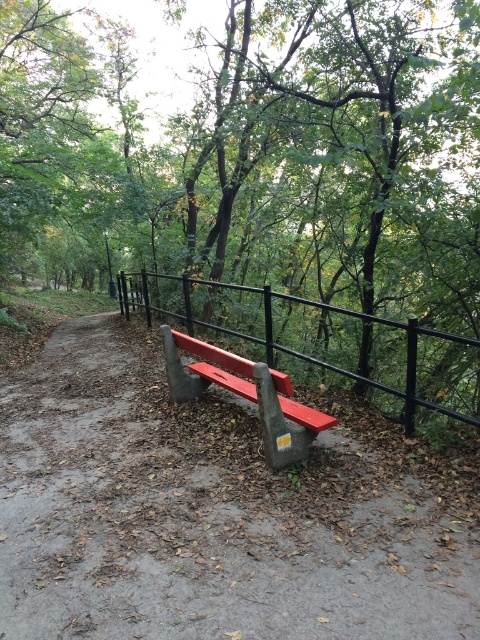
You are planning to take a photo of the smooth metal bench at center. To ensure the entire bench is visible in the frame, should you stand closer to the green leafy tree at center or farther away from it?

Since the green leafy tree at center is larger than the smooth metal bench at center, standing closer to the tree would bring the bench into a clearer focus and ensure it fills the frame appropriately.

You are planning to sit on one of the benches in the park. The concrete bench at center and the smooth metal bench at center are both available. Which bench is taller?

The concrete bench at center is taller than the smooth metal bench at center.